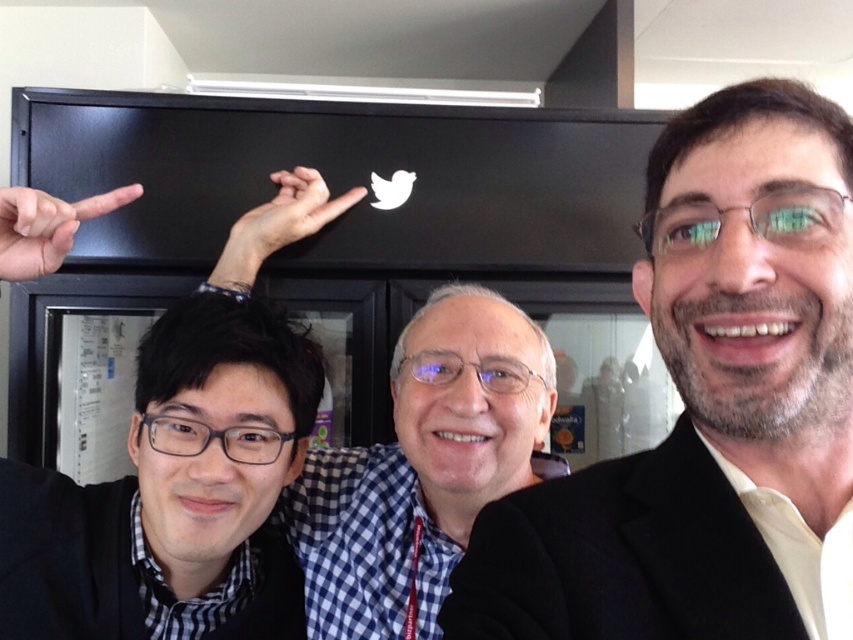
Question: Which point appears closest to the camera in this image?

Choices:
 (A) (171, 349)
 (B) (775, 593)
 (C) (306, 218)
 (D) (78, 221)

Answer: (B)

Question: Estimate the real-world distances between objects in this image. Which object is closer to the smooth black suit at right?

Choices:
 (A) black matte laptop at upper left
 (B) matte black finger at left

Answer: (A)

Question: Is smooth black suit at right to the right of matte black finger at left from the viewer's perspective?

Choices:
 (A) no
 (B) yes

Answer: (B)

Question: Which point is farther to the camera?

Choices:
 (A) matte black hand at center
 (B) black matte laptop at upper left
 (C) matte black finger at left

Answer: (A)

Question: Can you confirm if smooth black suit at right is positioned to the left of matte black hand at center?

Choices:
 (A) yes
 (B) no

Answer: (B)

Question: In this image, where is smooth black suit at right located relative to matte black finger at left?

Choices:
 (A) right
 (B) left

Answer: (A)